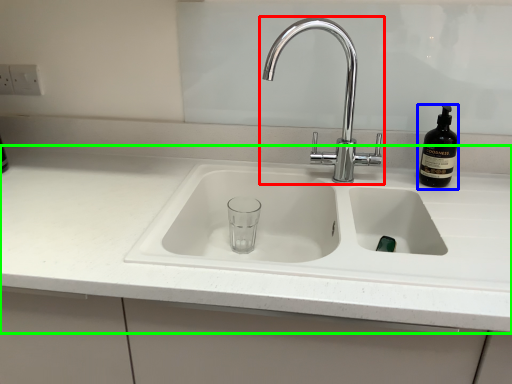
Question: Which object is positioned farthest from tap (highlighted by a red box)? Select from bottle (highlighted by a blue box) and countertop (highlighted by a green box).

Choices:
 (A) bottle
 (B) countertop

Answer: (B)